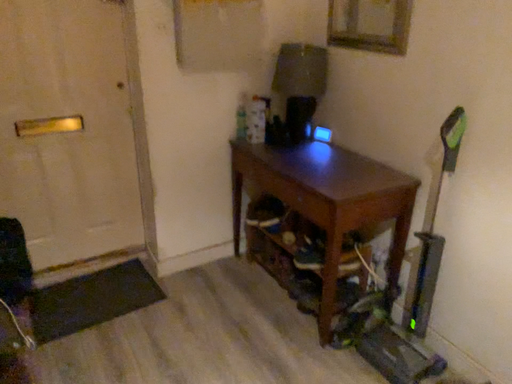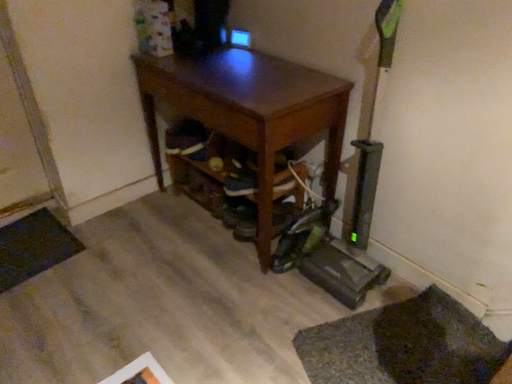
Question: Which way did the camera rotate in the video?

Choices:
 (A) rotated right
 (B) rotated left

Answer: (A)